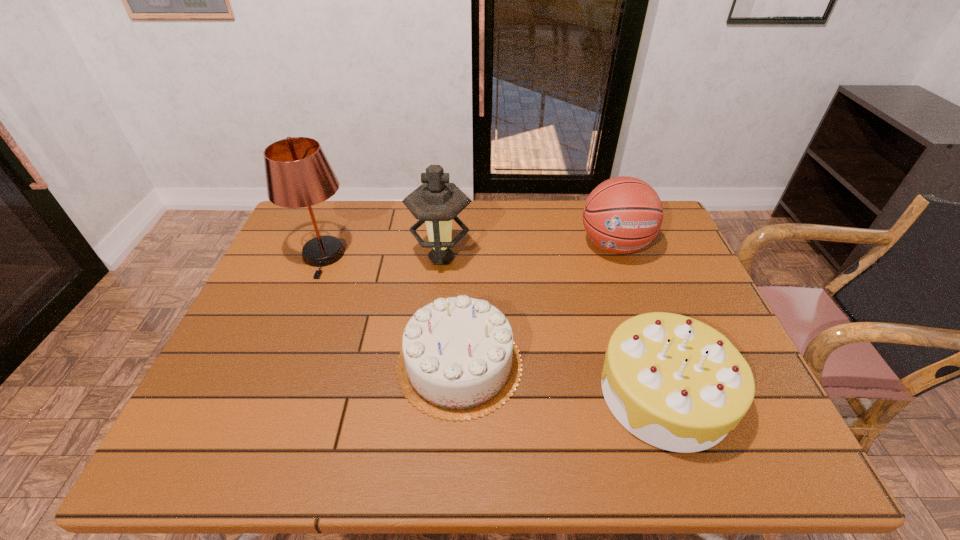
Locate an element on the screen. The height and width of the screenshot is (540, 960). object that is at the near right corner is located at coordinates (676, 383).

In the image, there is a desktop. Identify the location of vacant space at the far edge. This screenshot has height=540, width=960. (520, 236).

The image size is (960, 540). In order to click on vacant space at the near edge of the desktop in this screenshot , I will do point(453,429).

Locate an element on the screen. The height and width of the screenshot is (540, 960). vacant space at the left edge is located at coordinates (261, 421).

You are a GUI agent. You are given a task and a screenshot of the screen. Output one action in this format:
    pyautogui.click(x=<x>, y=<y>)
    Task: Click on the blank area at the far left corner
    
    Given the screenshot: What is the action you would take?
    pyautogui.click(x=290, y=237)

Image resolution: width=960 pixels, height=540 pixels. In order to click on unoccupied position between the leftmost object and the basketball in this screenshot , I will do `click(468, 251)`.

Find the location of `vacant space in between the third shortest object and the left birthday cake`. vacant space in between the third shortest object and the left birthday cake is located at coordinates (537, 305).

At what (x,y) coordinates should I click in order to perform the action: click on empty space that is in between the basketball and the tallest object. Please return your answer as a coordinate pair (x, y). This screenshot has height=540, width=960. Looking at the image, I should click on [468, 251].

The height and width of the screenshot is (540, 960). In order to click on vacant space that's between the basketball and the left birthday cake in this screenshot , I will do `click(537, 305)`.

Find the location of a particular element. vacant point located between the right birthday cake and the second tallest object is located at coordinates (553, 326).